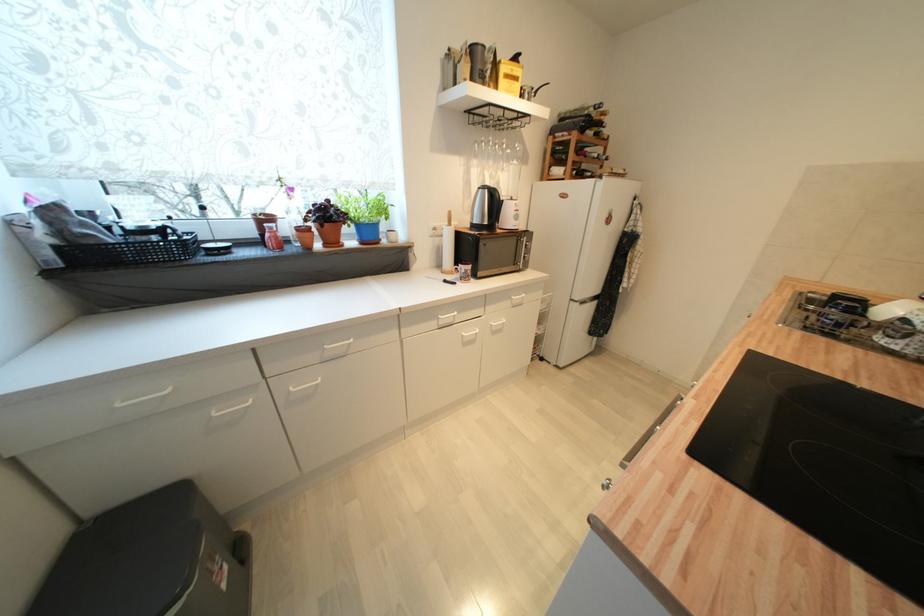
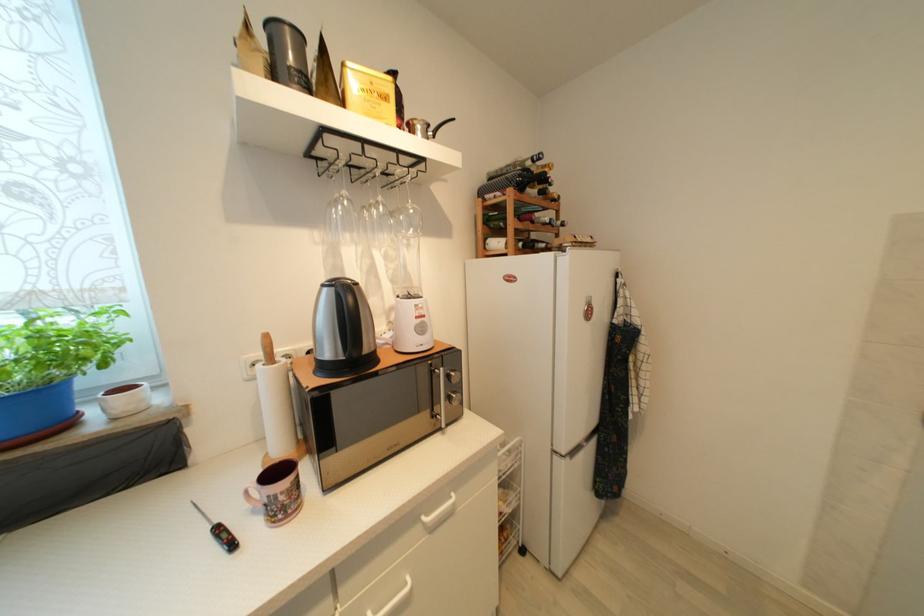
Where in the second image is the point corresponding to point (458, 285) from the first image?

(237, 546)